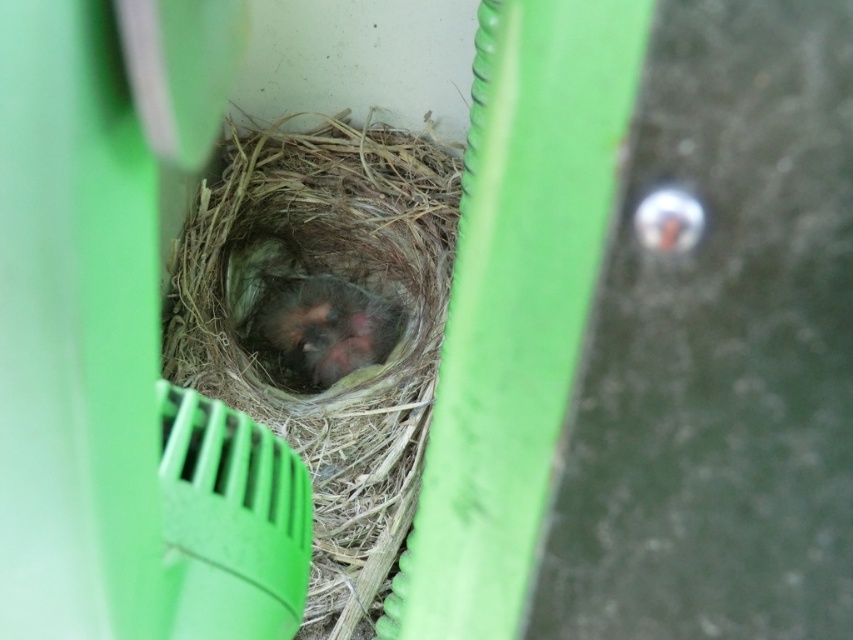
From the picture: You are a bird parent looking to return to your nest. From your perspective, which object is closer to you as you approach the brown straw nest at center and the fluffy downy chicks at center?

The brown straw nest at center is closer to you because it is positioned in front of the fluffy downy chicks at center.

You are a bird parent looking to ensure your fluffy downy chicks at center have enough space in the brown straw nest at center. Based on the scene, can you confirm if the nest is wide enough to accommodate the chicks comfortably?

The brown straw nest at center has a width larger than the fluffy downy chicks at center, so yes, the nest is wide enough to accommodate the chicks comfortably.